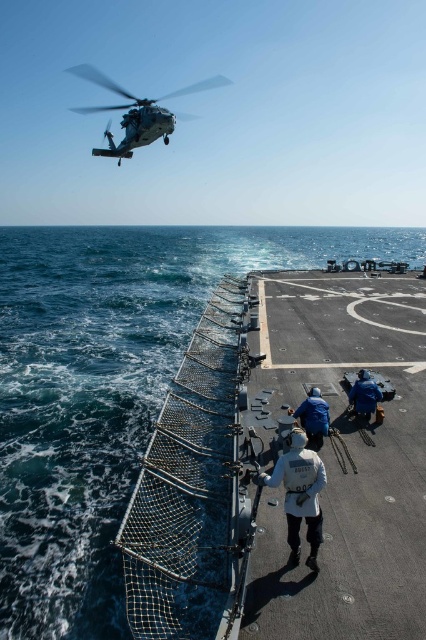
You are a sailor on the ship deck and need to secure a rope. The blue water at lower left and the white fabric jacket at center are in your line of sight. Which object is wider?

The blue water at lower left is wider than the white fabric jacket at center.

You are a crew member on the deck of a naval ship. You need to direct the metallic gray helicopter at upper center to land in the designated zone marked by white lines on the deck. However, there is a blue fabric jacket at lower right in your way. Which object should you move first to clear the landing path?

You should move the blue fabric jacket at lower right first because the metallic gray helicopter at upper center is to the left of the blue fabric jacket at lower right, meaning the jacket is blocking the helicopter from landing in the designated zone.